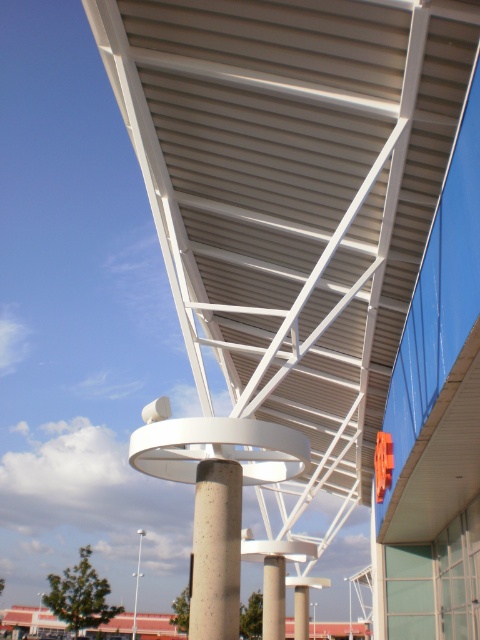
Can you confirm if white metal roof at center is positioned to the right of white concrete pole at center?

Indeed, white metal roof at center is positioned on the right side of white concrete pole at center.

Between white metal roof at center and white concrete pole at center, which one has less height?

white concrete pole at center

Which is in front, point (298, 387) or point (135, 612)?

Positioned in front is point (298, 387).

The height and width of the screenshot is (640, 480). I want to click on white metal roof at center, so click(x=292, y=193).

Does point (277, 632) come behind point (141, 573)?

No, it is not.

Which is above, concrete column at center or white concrete pole at center?

concrete column at center

Who is more forward, (272, 586) or (140, 563)?

Point (272, 586) is in front.

This screenshot has height=640, width=480. In order to click on concrete column at center in this screenshot , I will do `click(274, 596)`.

Is point (418, 172) in front of point (280, 557)?

Yes, point (418, 172) is closer to viewer.

Measure the distance from white metal roof at center to concrete column at center.

They are 8.35 meters apart.

Who is more distant from viewer, (x=276, y=173) or (x=279, y=579)?

Point (x=279, y=579)

What are the coordinates of `white metal roof at center` in the screenshot? It's located at (292, 193).